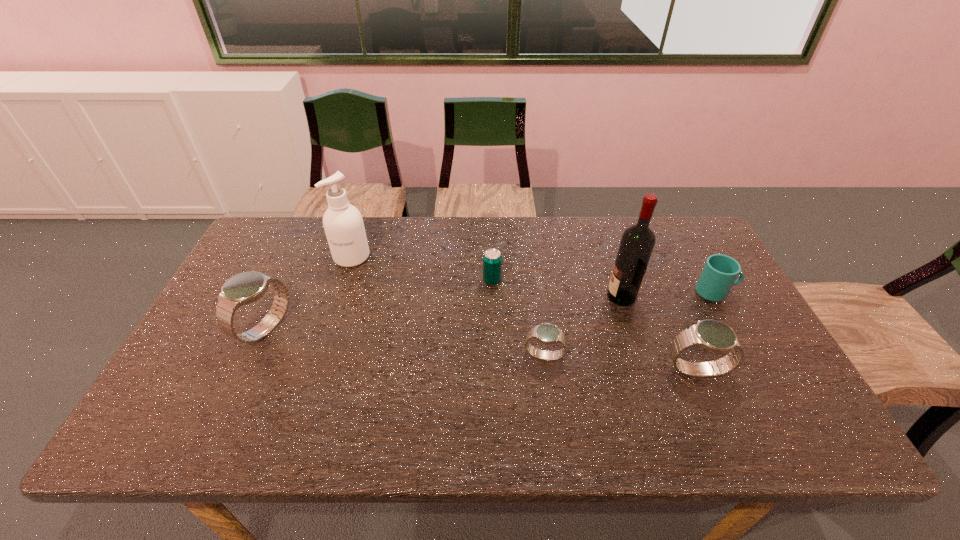
At what (x,y) coordinates should I click in order to perform the action: click on vacant space located on the back of the leftmost object. Please return your answer as a coordinate pair (x, y). Looking at the image, I should click on (313, 226).

Image resolution: width=960 pixels, height=540 pixels. In order to click on vacant space located on the left of the fourth object from left to right in this screenshot , I will do `click(504, 356)`.

Where is `free space located 0.390m on the left of the fourth shortest object`? This screenshot has height=540, width=960. free space located 0.390m on the left of the fourth shortest object is located at coordinates (506, 370).

Find the location of a particular element. The image size is (960, 540). free region located on the front label of the cleansing agent is located at coordinates (345, 280).

Image resolution: width=960 pixels, height=540 pixels. Identify the location of free space located 0.260m on the front and back of the third object from right to left. (516, 296).

Where is `vacant space situated on the front and back of the third object from right to left`? vacant space situated on the front and back of the third object from right to left is located at coordinates (562, 296).

Identify the location of vacant space located 0.320m on the front and back of the third object from right to left. (495, 296).

You are a GUI agent. You are given a task and a screenshot of the screen. Output one action in this format:
    pyautogui.click(x=<x>, y=<y>)
    Task: Click on the vacant space situated 0.070m on the right of the beer can
    This screenshot has height=540, width=960.
    Given the screenshot: What is the action you would take?
    pyautogui.click(x=524, y=281)

Identify the location of object located in the far edge section of the desktop. (343, 223).

Identify the location of object positioned at the near edge. (712, 335).